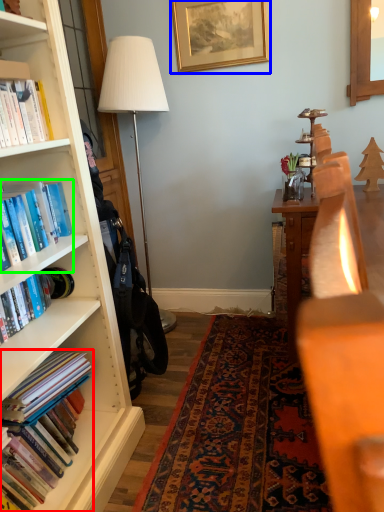
Question: Which is farther away from book (highlighted by a red box)? picture frame (highlighted by a blue box) or book (highlighted by a green box)?

Choices:
 (A) picture frame
 (B) book

Answer: (A)